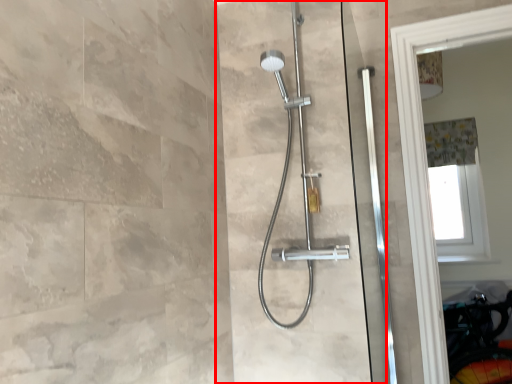
Question: From the image, what is the correct spatial relationship of screen door (annotated by the red box) in relation to shower curtain?

Choices:
 (A) left
 (B) right

Answer: (A)